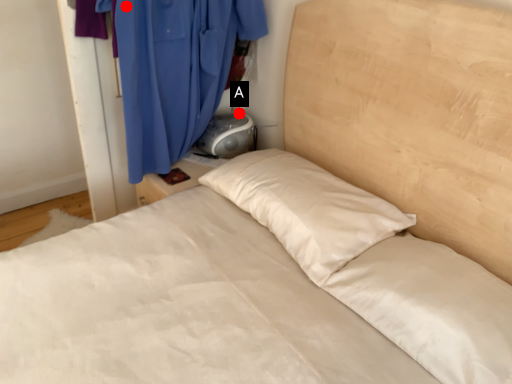
Question: Two points are circled on the image, labeled by A and B beside each circle. Among these points, which one is farthest from the camera?

Choices:
 (A) A is further
 (B) B is further

Answer: (A)